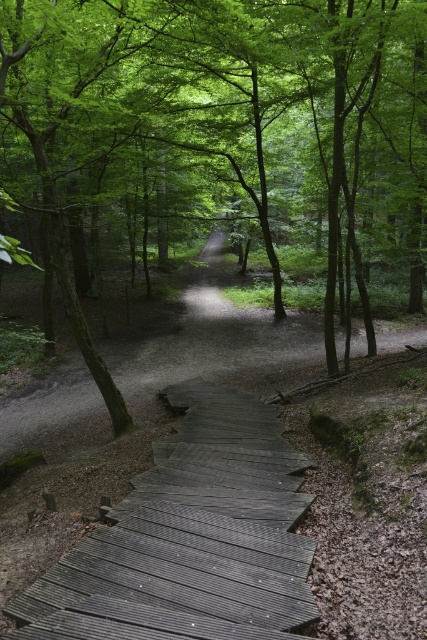
In the scene shown: You are a hiker who wants to take a photo of the dark gray wooden stairs at bottom center without the green leafy tree at center blocking the view. What should you do?

Move forward away from the green leafy tree at center so that it is no longer in front of the dark gray wooden stairs at bottom center.

You are standing at the entrance of the forest boardwalk and want to take a photo of both the green leafy tree at center and the dark gray wooden stairs at bottom center in the same frame. Based on their widths, which object should you zoom in or out to include both?

The green leafy tree at center might be wider than dark gray wooden stairs at bottom center, so you should zoom out to include both in the frame.

You are standing at the entrance of the wooden boardwalk and want to locate the green leafy tree at center. Which direction should you look to find it?

The green leafy tree at center is located at point coordinates of (224, 132). Since the boardwalk curves gently to the right, you should look forward and slightly to your left to find the green leafy tree at center.